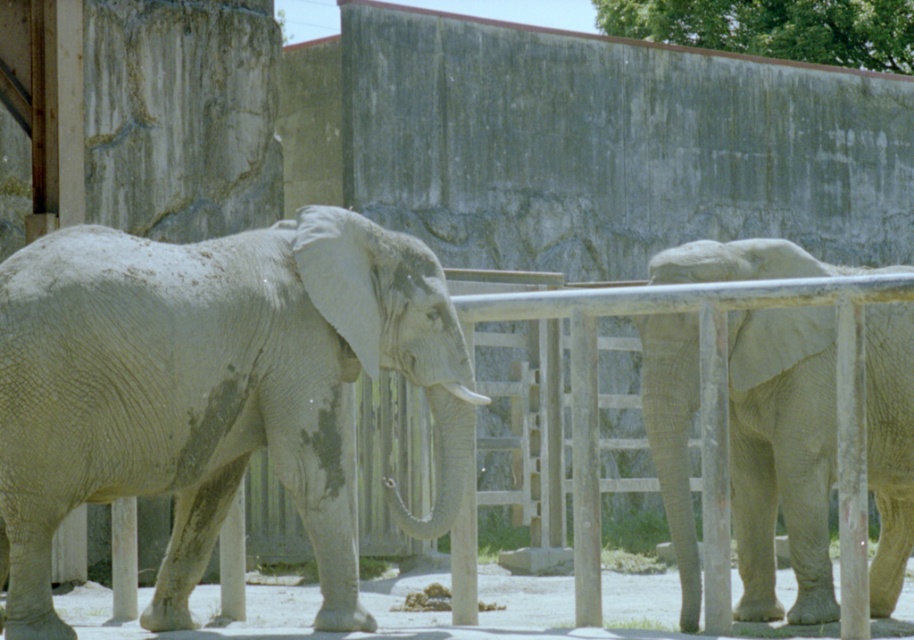
You are standing in the zoo enclosure and want to locate the gray textured elephant at center. Which direction should you face to see the point at coordinates (211,390)?

The point at coordinates (211,390) is located on the gray textured elephant at center. To see this point, you should face towards the gray textured elephant at center.

You are a zookeeper who needs to measure the distance between the two gray textured elephants. According to the scene, how far apart are the gray textured elephant at center and the gray textured elephant at right?

The gray textured elephant at center is 5.50 meters away from the gray textured elephant at right.

You are a zookeeper standing at the entrance of the enclosure. You need to feed the gray textured elephant at center. If your feeding tool has a maximum reach of 40 feet, will you be able to reach the elephant?

The gray textured elephant at center and the viewer are 41.97 feet apart. Since the feeding tool has a maximum reach of 40 feet, you cannot reach the elephant.